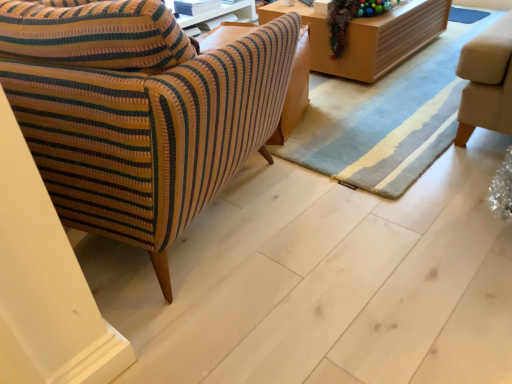
You are a GUI agent. You are given a task and a screenshot of the screen. Output one action in this format:
    pyautogui.click(x=<x>, y=<y>)
    Task: Click on the shiny metallic garland at upper right
    
    Given the screenshot: What is the action you would take?
    pyautogui.click(x=351, y=19)

This screenshot has width=512, height=384. What do you see at coordinates (150, 133) in the screenshot? I see `striped fabric armchair at left` at bounding box center [150, 133].

You are a GUI agent. You are given a task and a screenshot of the screen. Output one action in this format:
    pyautogui.click(x=<x>, y=<y>)
    Task: Click on the wooden table at upper center
    The width and height of the screenshot is (512, 384).
    Given the screenshot: What is the action you would take?
    pyautogui.click(x=368, y=37)

How many degrees apart are the facing directions of shiny metallic garland at upper right and striped fabric armchair at left?

The facing directions of shiny metallic garland at upper right and striped fabric armchair at left are 107 degrees apart.

Considering the relative sizes of shiny metallic garland at upper right and striped fabric armchair at left in the image provided, is shiny metallic garland at upper right wider than striped fabric armchair at left?

No, shiny metallic garland at upper right is not wider than striped fabric armchair at left.

Find the location of `christmas decoration that appears above the striped fabric armchair at left (from the image's perspective)`. christmas decoration that appears above the striped fabric armchair at left (from the image's perspective) is located at coordinates (351, 19).

From a real-world perspective, between shiny metallic garland at upper right and striped fabric armchair at left, who is vertically lower?

From a 3D spatial view, shiny metallic garland at upper right is below.

Is wooden table at upper center oriented away from shiny metallic garland at upper right?

No, wooden table at upper center is not facing the opposite direction of shiny metallic garland at upper right.

Is point (350, 36) more distant than point (339, 55)?

No, it is not.

Identify the location of christmas decoration on the left of wooden table at upper center. (351, 19).

Between wooden table at upper center and shiny metallic garland at upper right, which one has less height?

wooden table at upper center.

Is shiny metallic garland at upper right in front of wooden table at upper center?

Yes.

Where is `christmas decoration that appears on the left of wooden table at upper center`? This screenshot has width=512, height=384. christmas decoration that appears on the left of wooden table at upper center is located at coordinates (351, 19).

From the image's perspective, does shiny metallic garland at upper right appear lower than wooden table at upper center?

Yes.

I want to click on christmas decoration lying above the striped fabric armchair at left (from the image's perspective), so click(x=351, y=19).

From their relative heights in the image, would you say striped fabric armchair at left is taller or shorter than shiny metallic garland at upper right?

In the image, striped fabric armchair at left appears to be taller than shiny metallic garland at upper right.

Is shiny metallic garland at upper right at the back of striped fabric armchair at left?

No, shiny metallic garland at upper right is not at the back of striped fabric armchair at left.

How different are the orientations of striped fabric armchair at left and shiny metallic garland at upper right in degrees?

They differ by 107 degrees in their facing directions.

Is wooden table at upper center beside striped fabric armchair at left?

No, wooden table at upper center is not in contact with striped fabric armchair at left.

From a real-world perspective, relative to striped fabric armchair at left, is wooden table at upper center vertically above or below?

From a real-world perspective, wooden table at upper center is physically below striped fabric armchair at left.

Does wooden table at upper center have a larger size compared to striped fabric armchair at left?

No, wooden table at upper center is not bigger than striped fabric armchair at left.

Would you say striped fabric armchair at left is outside wooden table at upper center?

Yes.

Which object is closer to the camera taking this photo, striped fabric armchair at left or wooden table at upper center?

striped fabric armchair at left is more forward.

Consider the image. Who is smaller, striped fabric armchair at left or wooden table at upper center?

wooden table at upper center.

In the scene shown: Is wooden table at upper center at the back of striped fabric armchair at left?

striped fabric armchair at left is not turned away from wooden table at upper center.

Where is `chair in front of the shiny metallic garland at upper right`? The height and width of the screenshot is (384, 512). chair in front of the shiny metallic garland at upper right is located at coordinates (150, 133).

The image size is (512, 384). In order to click on christmas decoration on the left of wooden table at upper center in this screenshot , I will do `click(351, 19)`.

Based on the photo, looking at the image, which one is located closer to wooden table at upper center, striped fabric armchair at left or shiny metallic garland at upper right?

shiny metallic garland at upper right is positioned closer to the anchor wooden table at upper center.

Considering their positions, is wooden table at upper center positioned closer to shiny metallic garland at upper right than striped fabric armchair at left?

Based on the image, wooden table at upper center appears to be nearer to shiny metallic garland at upper right.

Based on their spatial positions, is striped fabric armchair at left or wooden table at upper center further from shiny metallic garland at upper right?

Among the two, striped fabric armchair at left is located further to shiny metallic garland at upper right.

When comparing their distances from striped fabric armchair at left, does wooden table at upper center or shiny metallic garland at upper right seem further?

wooden table at upper center.

Looking at the image, which one is located closer to wooden table at upper center, shiny metallic garland at upper right or striped fabric armchair at left?

shiny metallic garland at upper right is positioned closer to the anchor wooden table at upper center.

Estimate the real-world distances between objects in this image. Which object is further from striped fabric armchair at left, shiny metallic garland at upper right or wooden table at upper center?

The object further to striped fabric armchair at left is wooden table at upper center.

Find the location of a particular element. This screenshot has width=512, height=384. christmas decoration between striped fabric armchair at left and wooden table at upper center in the front-back direction is located at coordinates (351, 19).